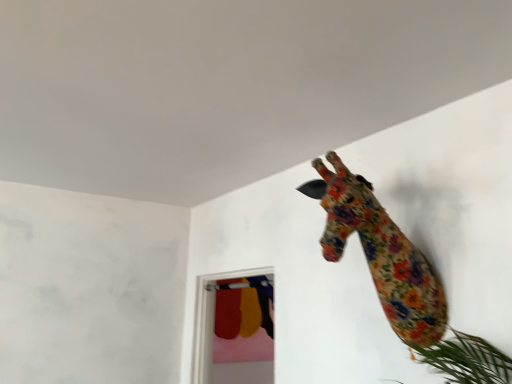
Question: Looking at the image, does transparent glass door at center seem bigger or smaller compared to floral fabric giraffe at upper right?

Choices:
 (A) big
 (B) small

Answer: (A)

Question: Considering their positions, is transparent glass door at center located in front of or behind floral fabric giraffe at upper right?

Choices:
 (A) behind
 (B) front

Answer: (A)

Question: Considering the positions of point (223, 357) and point (330, 253), is point (223, 357) closer or farther from the camera than point (330, 253)?

Choices:
 (A) closer
 (B) farther

Answer: (B)

Question: Is floral fabric giraffe at upper right taller or shorter than transparent glass door at center?

Choices:
 (A) short
 (B) tall

Answer: (A)

Question: Considering the positions of point (323, 173) and point (215, 334), is point (323, 173) closer or farther from the camera than point (215, 334)?

Choices:
 (A) farther
 (B) closer

Answer: (B)

Question: Would you say floral fabric giraffe at upper right is to the left or to the right of transparent glass door at center in the picture?

Choices:
 (A) right
 (B) left

Answer: (A)

Question: From a real-world perspective, relative to transparent glass door at center, is floral fabric giraffe at upper right vertically above or below?

Choices:
 (A) below
 (B) above

Answer: (B)